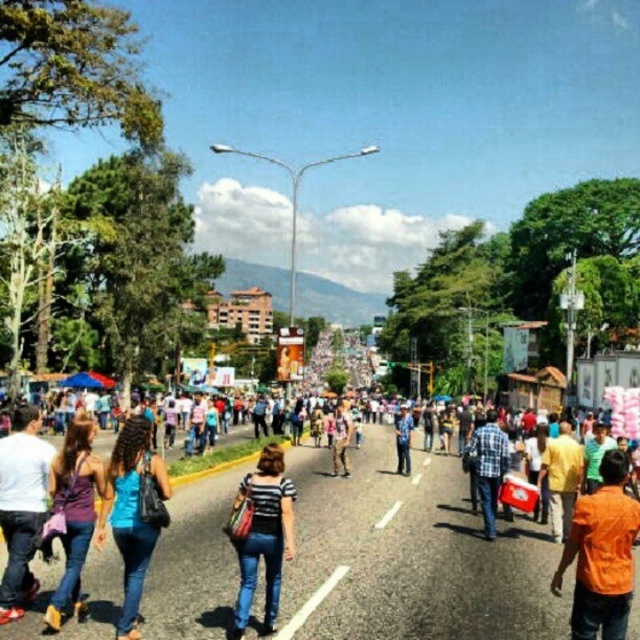
You are a photographer trying to capture a photo of the purple fabric dress at center and the blue plaid shirt at center in the street scene. Since you want both subjects to be clearly visible, which one should you focus on first to ensure proper focus, considering their sizes?

The purple fabric dress at center has a greater height compared to the blue plaid shirt at center, so you should focus on the purple fabric dress at center first to ensure proper focus due to its larger size.

You are standing at point (400, 474) and want to walk to point (148, 528). Which direction should you move relative to the other point?

Point (148, 528) is in front of point (400, 474), so you should move forward towards it.